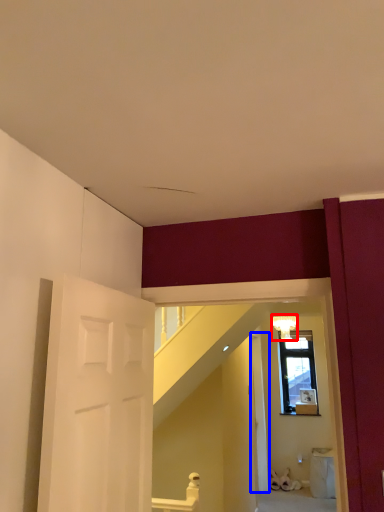
Question: Which point is further to the camera, light fixture (highlighted by a red box) or door (highlighted by a blue box)?

Choices:
 (A) light fixture
 (B) door

Answer: (A)